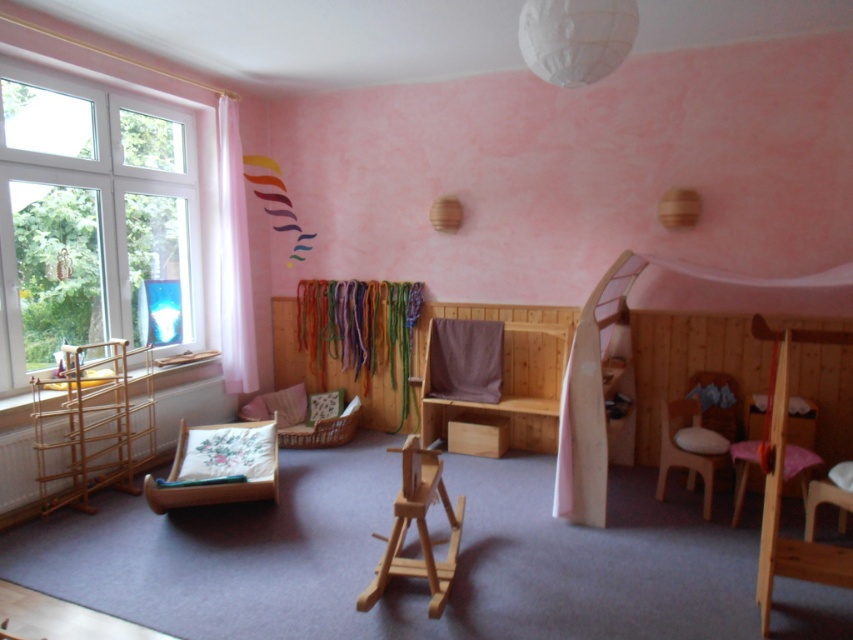
You are a parent trying to place a new toy box that is 1.2 meters wide in the center of the room. The wooden bunk bed at center and wooden armchair at center are both in the center area. Can you fit the toy box between them without moving either object?

The wooden bunk bed at center might be wider than wooden armchair at center, so it is uncertain if there is enough space between them to fit the 1.2 meter wide toy box. You may need to measure the distance between them first.

You are a parent trying to decide where to place a new 1.5 meter tall bookshelf in the room. The bookshelf needs to be placed either next to the white plastic window at left or near the wooden bunk bed at center. Based on their heights, which location would allow the bookshelf to fit better without blocking too much light?

The white plastic window at left is much taller than the wooden bunk bed at center. Since the bookshelf is 1.5 meters tall, placing it next to the taller window would leave more space and allow natural light to pass through without obstruction.

You are a parent trying to place a new toy box that is the same size as the wooden armchair at center in the room. Can the toy box fit in the space currently occupied by the wooden bunk bed at center?

The wooden bunk bed at center is bigger than the wooden armchair at center. Since the toy box is the same size as the wooden armchair at center, it can fit in the space currently occupied by the wooden bunk bed at center because the bunk bed is larger.